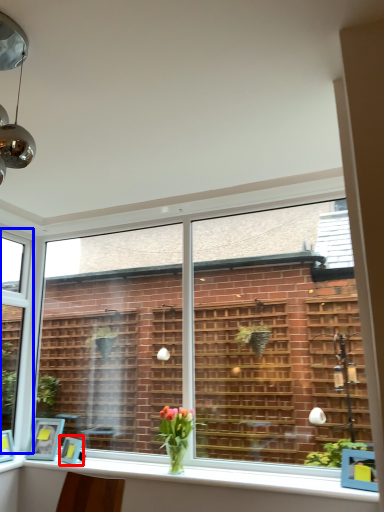
Question: Which point is further to the camera, picture frame (highlighted by a red box) or window (highlighted by a blue box)?

Choices:
 (A) picture frame
 (B) window

Answer: (B)